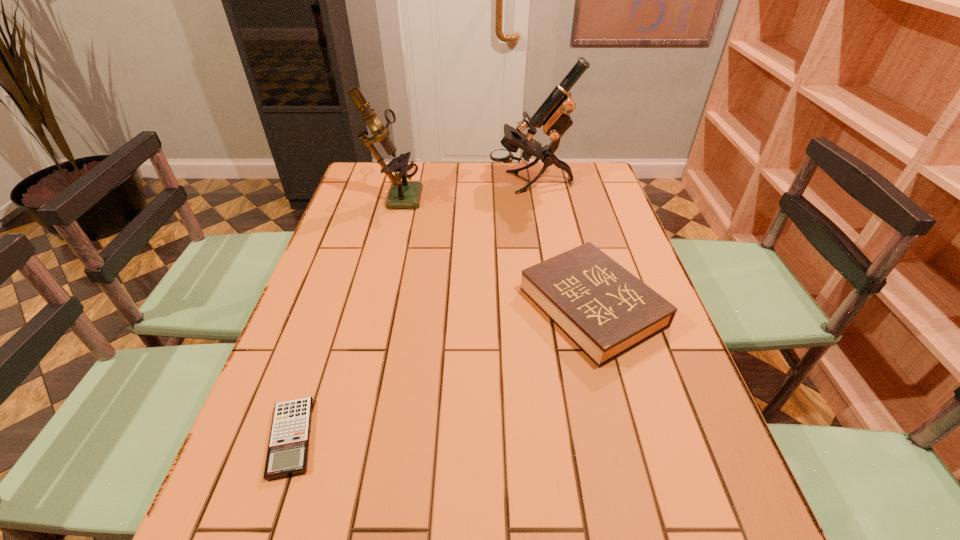
This screenshot has width=960, height=540. What are the coordinates of `vacant region at the right edge` in the screenshot? It's located at (676, 423).

Identify the location of blank area at the far right corner. (604, 186).

Identify the location of vacant space in between the hardback book and the right microscope. This screenshot has height=540, width=960. (561, 245).

This screenshot has height=540, width=960. I want to click on free space between the shortest object and the third tallest object, so click(442, 373).

The width and height of the screenshot is (960, 540). Find the location of `free space between the right microscope and the left microscope`. free space between the right microscope and the left microscope is located at coordinates (463, 189).

At what (x,y) coordinates should I click in order to perform the action: click on free spot between the hardback book and the left microscope. Please return your answer as a coordinate pair (x, y). The width and height of the screenshot is (960, 540). Looking at the image, I should click on (492, 251).

At what (x,y) coordinates should I click in order to perform the action: click on free space that is in between the third farthest object and the right microscope. Please return your answer as a coordinate pair (x, y). This screenshot has width=960, height=540. Looking at the image, I should click on (561, 245).

Locate an element on the screen. Image resolution: width=960 pixels, height=540 pixels. vacant space that's between the hardback book and the right microscope is located at coordinates (561, 245).

Identify the location of free area in between the nearest object and the right microscope. The height and width of the screenshot is (540, 960). (411, 310).

You are a GUI agent. You are given a task and a screenshot of the screen. Output one action in this format:
    pyautogui.click(x=<x>, y=<y>)
    Task: Click on the vacant space that's between the hardback book and the left microscope
    This screenshot has height=540, width=960.
    Given the screenshot: What is the action you would take?
    pyautogui.click(x=492, y=251)